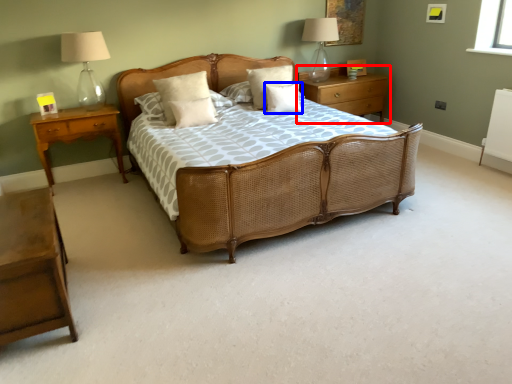
Question: Which of the following is the closest to the observer, nightstand (highlighted by a red box) or pillow (highlighted by a blue box)?

Choices:
 (A) nightstand
 (B) pillow

Answer: (B)